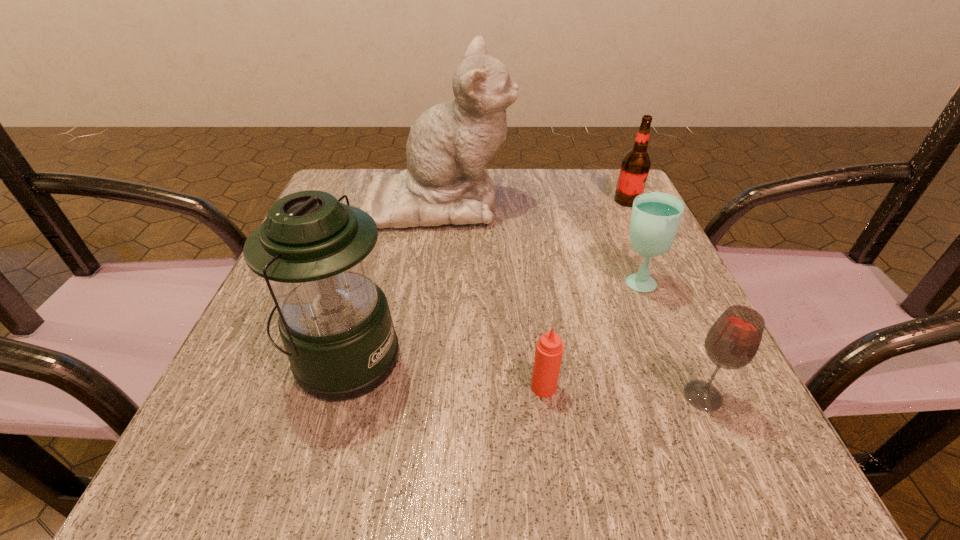
This screenshot has height=540, width=960. I want to click on the tallest object, so click(446, 182).

The image size is (960, 540). In order to click on the second tallest object in this screenshot , I will do `click(335, 323)`.

Where is `root beer`? The width and height of the screenshot is (960, 540). root beer is located at coordinates (636, 163).

Identify the location of the farther glass drink container. (656, 216).

This screenshot has width=960, height=540. I want to click on the nearer glass drink container, so click(733, 340).

You are a GUI agent. You are given a task and a screenshot of the screen. Output one action in this format:
    pyautogui.click(x=<x>, y=<y>)
    Task: Click on the shortest object
    Image resolution: width=960 pixels, height=540 pixels.
    Given the screenshot: What is the action you would take?
    pyautogui.click(x=549, y=348)

Where is `vacant space located 0.120m on the front-facing side of the cat`? This screenshot has height=540, width=960. vacant space located 0.120m on the front-facing side of the cat is located at coordinates click(564, 201).

What are the coordinates of `free space located on the back of the fifth shortest object` in the screenshot? It's located at (371, 266).

Locate an element on the screen. This screenshot has height=540, width=960. vacant space located 0.070m on the back of the root beer is located at coordinates (617, 179).

The height and width of the screenshot is (540, 960). I want to click on free space located on the left of the farther glass drink container, so click(534, 281).